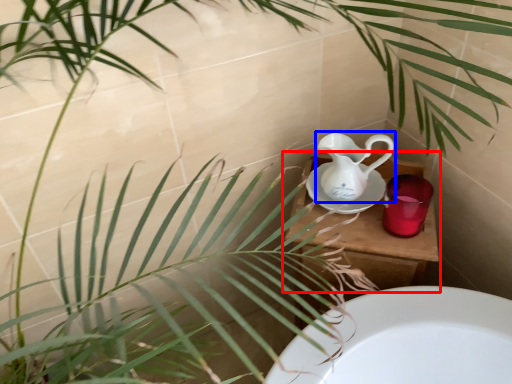
Question: Which of the following is the farthest to the observer, table (highlighted by a red box) or jug (highlighted by a blue box)?

Choices:
 (A) table
 (B) jug

Answer: (A)